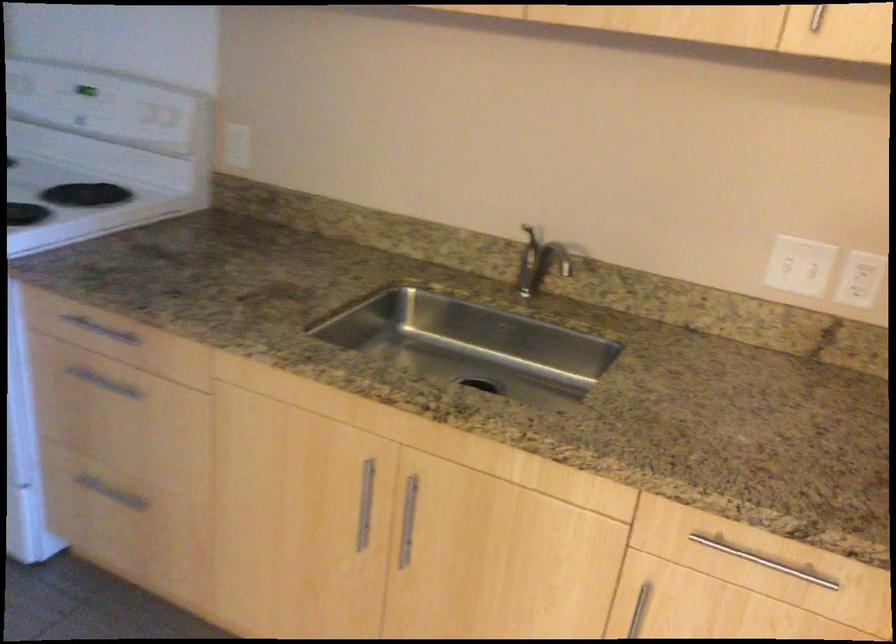
Find where to push the outlet test button. Please return your answer as a coordinate pair (x, y).

(85, 90)